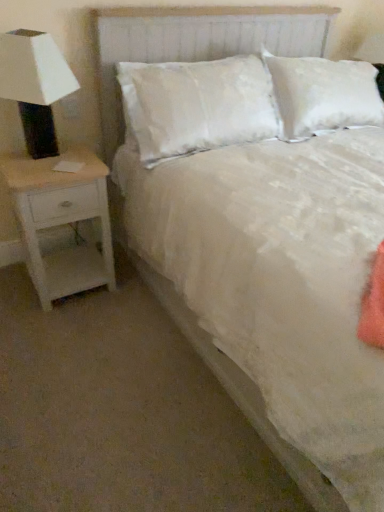
Question: From the image's perspective, is white matte lamp at left under white textured headboard at center?

Choices:
 (A) no
 (B) yes

Answer: (B)

Question: Is white matte lamp at left looking in the opposite direction of white textured headboard at center?

Choices:
 (A) no
 (B) yes

Answer: (A)

Question: Are white matte lamp at left and white textured headboard at center far apart?

Choices:
 (A) no
 (B) yes

Answer: (A)

Question: Is white matte lamp at left touching white textured headboard at center?

Choices:
 (A) no
 (B) yes

Answer: (A)

Question: Is white matte lamp at left surrounding white textured headboard at center?

Choices:
 (A) no
 (B) yes

Answer: (A)

Question: Is white textured headboard at center situated inside white wood nightstand at left or outside?

Choices:
 (A) outside
 (B) inside

Answer: (A)

Question: From their relative heights in the image, would you say white textured headboard at center is taller or shorter than white wood nightstand at left?

Choices:
 (A) tall
 (B) short

Answer: (A)

Question: Relative to white wood nightstand at left, is white textured headboard at center in front or behind?

Choices:
 (A) front
 (B) behind

Answer: (A)

Question: In terms of size, does white textured headboard at center appear bigger or smaller than white wood nightstand at left?

Choices:
 (A) small
 (B) big

Answer: (B)

Question: Looking at their shapes, would you say white wood nightstand at left is wider or thinner than white matte lamp at left?

Choices:
 (A) wide
 (B) thin

Answer: (A)

Question: Which is correct: white wood nightstand at left is inside white matte lamp at left, or outside of it?

Choices:
 (A) inside
 (B) outside

Answer: (B)

Question: Is point (102, 212) closer or farther from the camera than point (9, 80)?

Choices:
 (A) farther
 (B) closer

Answer: (A)

Question: Considering the positions of white wood nightstand at left and white matte lamp at left in the image, is white wood nightstand at left taller or shorter than white matte lamp at left?

Choices:
 (A) short
 (B) tall

Answer: (B)

Question: Do you think white textured headboard at center is within white matte lamp at left, or outside of it?

Choices:
 (A) inside
 (B) outside

Answer: (B)

Question: From a real-world perspective, relative to white matte lamp at left, is white textured headboard at center vertically above or below?

Choices:
 (A) above
 (B) below

Answer: (B)